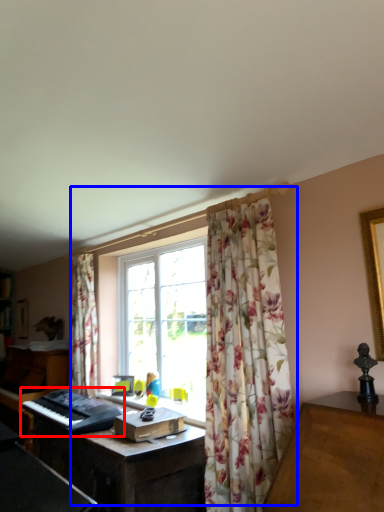
Question: Which object is closer to the camera taking this photo, musical keyboard (highlighted by a red box) or window (highlighted by a blue box)?

Choices:
 (A) musical keyboard
 (B) window

Answer: (B)